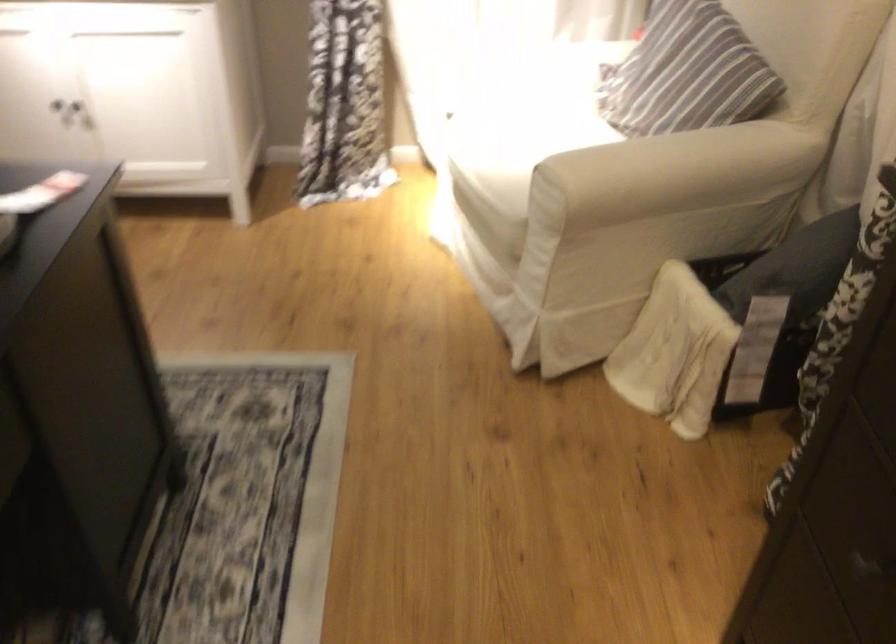
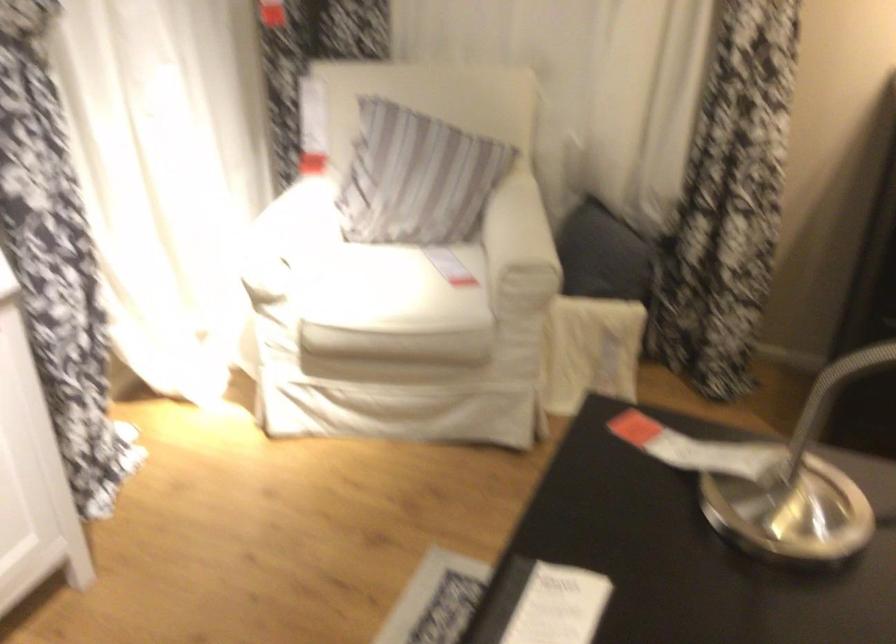
Locate, in the second image, the point that corresponds to point (623, 145) in the first image.

(509, 228)